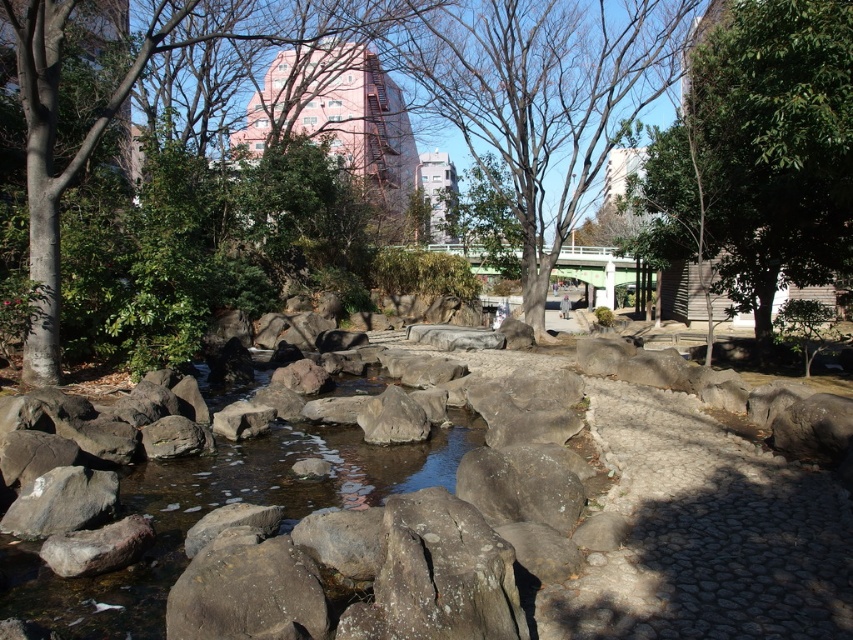
Question: Can you confirm if bare wood tree at center is wider than green leafy tree at upper left?

Choices:
 (A) no
 (B) yes

Answer: (A)

Question: From the image, what is the correct spatial relationship of green leafy tree at center in relation to green leafy tree at upper left?

Choices:
 (A) below
 (B) above

Answer: (A)

Question: Among these points, which one is farthest from the camera?

Choices:
 (A) (788, 172)
 (B) (450, 86)

Answer: (B)

Question: Which object is farther from the camera taking this photo?

Choices:
 (A) green leafy tree at upper left
 (B) green leafy tree at center

Answer: (A)

Question: Which point appears farthest from the camera in this image?

Choices:
 (A) (531, 28)
 (B) (808, 8)
 (C) (248, 40)

Answer: (C)

Question: Observing the image, what is the correct spatial positioning of green leafy tree at center in reference to green leafy tree at upper left?

Choices:
 (A) left
 (B) right

Answer: (B)